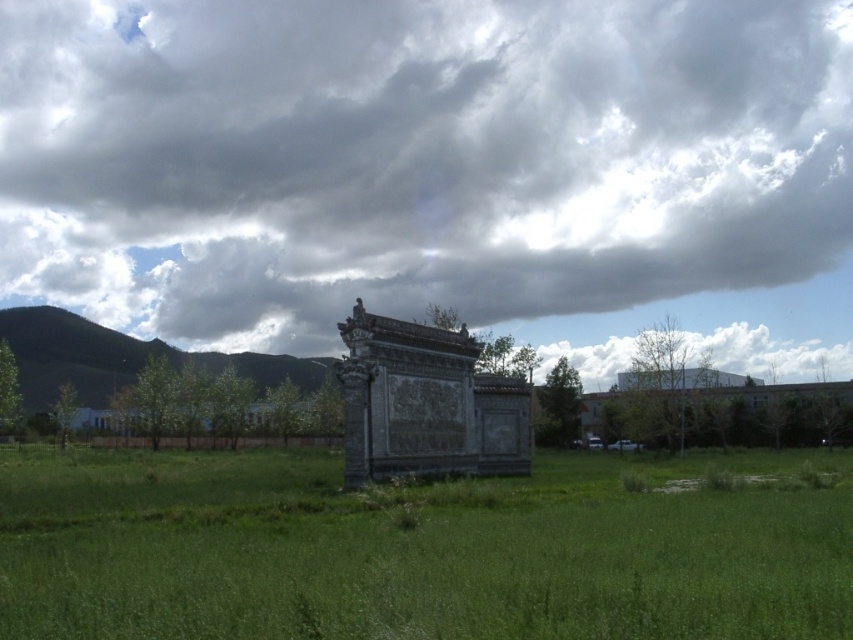
Question: Is green grass at center to the left of green grassy hill at left from the viewer's perspective?

Choices:
 (A) no
 (B) yes

Answer: (A)

Question: Among these points, which one is nearest to the camera?

Choices:
 (A) (38, 381)
 (B) (120, 36)
 (C) (590, 460)

Answer: (C)

Question: Is cloudy sky at upper center to the right of green grass at center from the viewer's perspective?

Choices:
 (A) no
 (B) yes

Answer: (B)

Question: Is cloudy sky at upper center wider than dark gray stone monument at center?

Choices:
 (A) no
 (B) yes

Answer: (B)

Question: Which of the following is the farthest from the observer?

Choices:
 (A) (254, 371)
 (B) (456, 404)
 (C) (476, 269)

Answer: (C)

Question: Which point is farther to the camera?

Choices:
 (A) green grass at center
 (B) green grassy hill at left

Answer: (B)